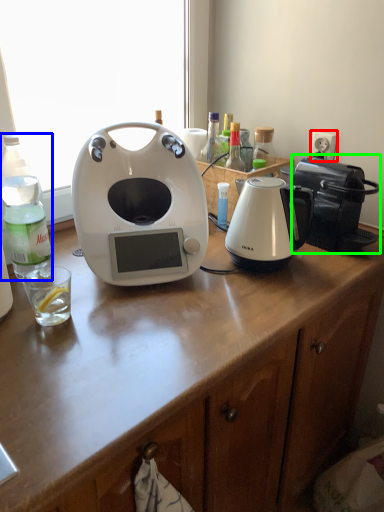
Question: Which object is positioned farthest from power outlet (highlighted by a red box)? Select from bottle (highlighted by a blue box) and toaster (highlighted by a green box).

Choices:
 (A) bottle
 (B) toaster

Answer: (A)